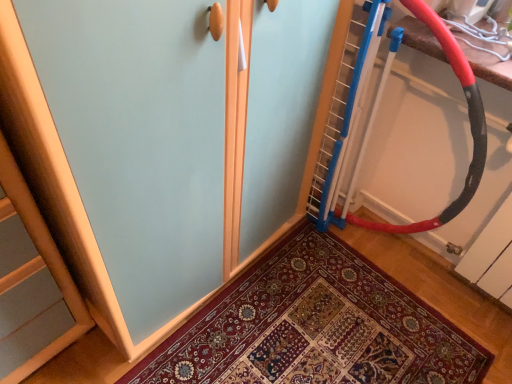
Image resolution: width=512 pixels, height=384 pixels. Identify the location of vacant space underneath red rubber garden hose at right (from a real-world perspective). click(x=374, y=259).